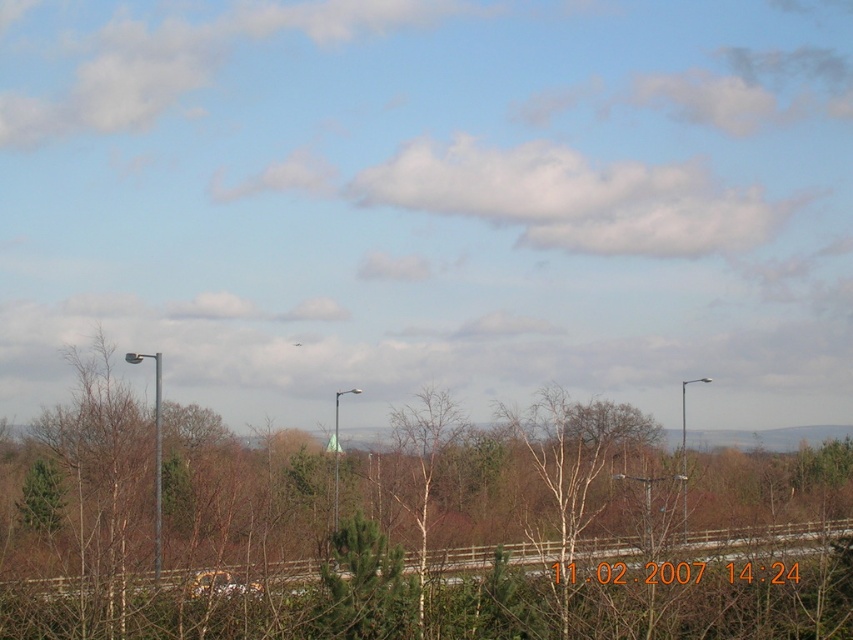
Question: Which point is farther from the camera taking this photo?

Choices:
 (A) (334, 454)
 (B) (3, 618)
 (C) (807, 547)

Answer: (A)

Question: Can you confirm if green leafy tree at center is positioned above white fluffy cloud at upper center?

Choices:
 (A) yes
 (B) no

Answer: (B)

Question: Does white fluffy cloud at upper center appear under metallic pole at left?

Choices:
 (A) yes
 (B) no

Answer: (B)

Question: Can you confirm if green matte tree at lower left is thinner than metallic pole at right?

Choices:
 (A) yes
 (B) no

Answer: (A)

Question: Which object appears closest to the camera in this image?

Choices:
 (A) metallic pole at center
 (B) green leafy tree at center
 (C) metallic pole at left

Answer: (B)

Question: Which of the following is the closest to the observer?

Choices:
 (A) (334, 522)
 (B) (840, 472)

Answer: (A)